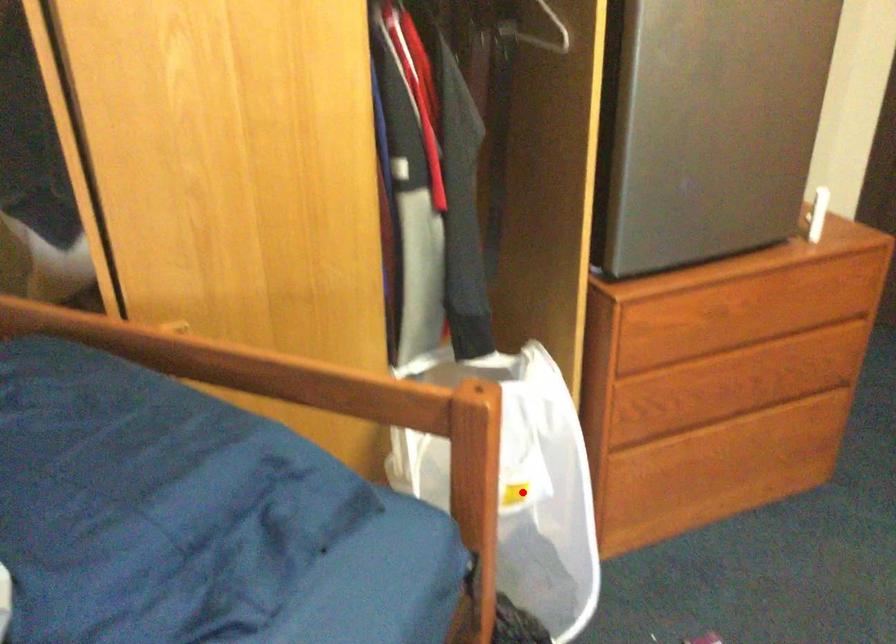
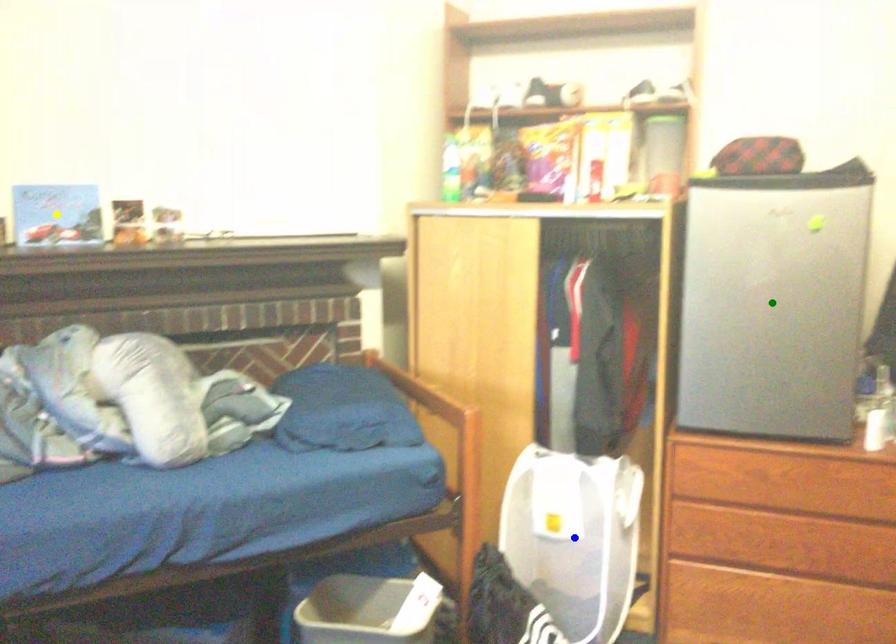
Question: I am providing you with two images of the same scene from different viewpoints. A red point is marked on the first image. You are given multiple points on the second image. Which point in image 2 is actually the same real-world point as the red point in image 1?

Choices:
 (A) green point
 (B) yellow point
 (C) blue point

Answer: (C)